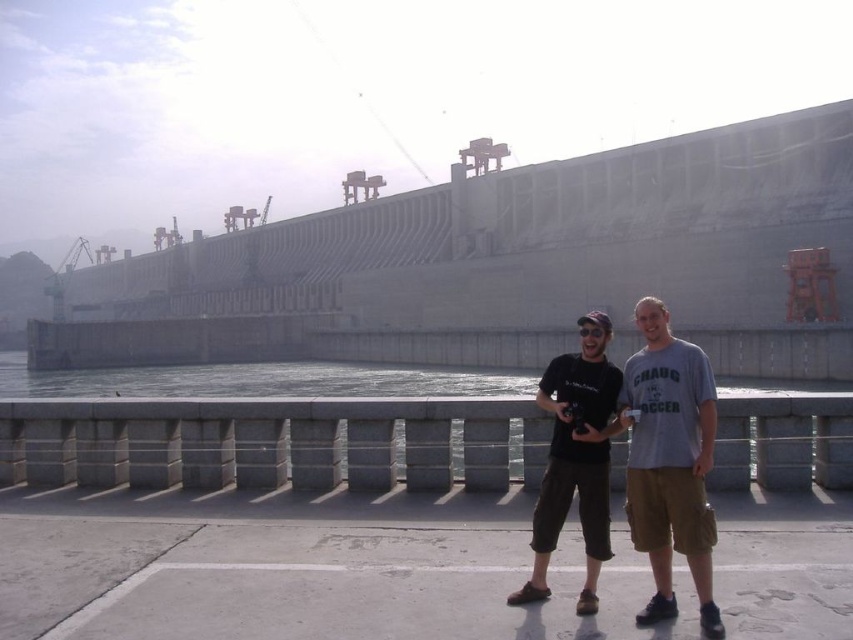
Question: Does gray cotton t-shirt at center have a larger size compared to matte black t-shirt at center?

Choices:
 (A) no
 (B) yes

Answer: (B)

Question: Is gray cotton t-shirt at center bigger than matte black t-shirt at center?

Choices:
 (A) no
 (B) yes

Answer: (B)

Question: Can you confirm if gray cotton t-shirt at center is positioned above matte black t-shirt at center?

Choices:
 (A) yes
 (B) no

Answer: (A)